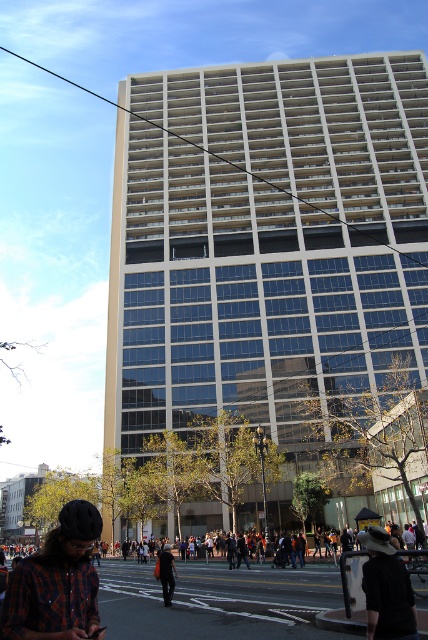
Does black fabric hat at lower right have a smaller size compared to dark blue jeans at center?

Yes.

Does point (383, 618) lie behind point (166, 605)?

No, it is not.

Where is `black fabric hat at lower right`? black fabric hat at lower right is located at coordinates (386, 589).

Does plaid flannel shirt at lower left have a lesser width compared to dark blue jeans at center?

Indeed, plaid flannel shirt at lower left has a lesser width compared to dark blue jeans at center.

Is point (88, 522) positioned in front of point (160, 556)?

That is True.

The height and width of the screenshot is (640, 428). I want to click on plaid flannel shirt at lower left, so click(56, 580).

Who is more forward, (50, 612) or (394, 573)?

Point (50, 612) is more forward.

Is plaid flannel shirt at lower left closer to the viewer compared to black fabric hat at lower right?

Yes, plaid flannel shirt at lower left is in front of black fabric hat at lower right.

Is point (56, 588) less distant than point (407, 620)?

That is True.

Identify the location of plaid flannel shirt at lower left. The height and width of the screenshot is (640, 428). (56, 580).